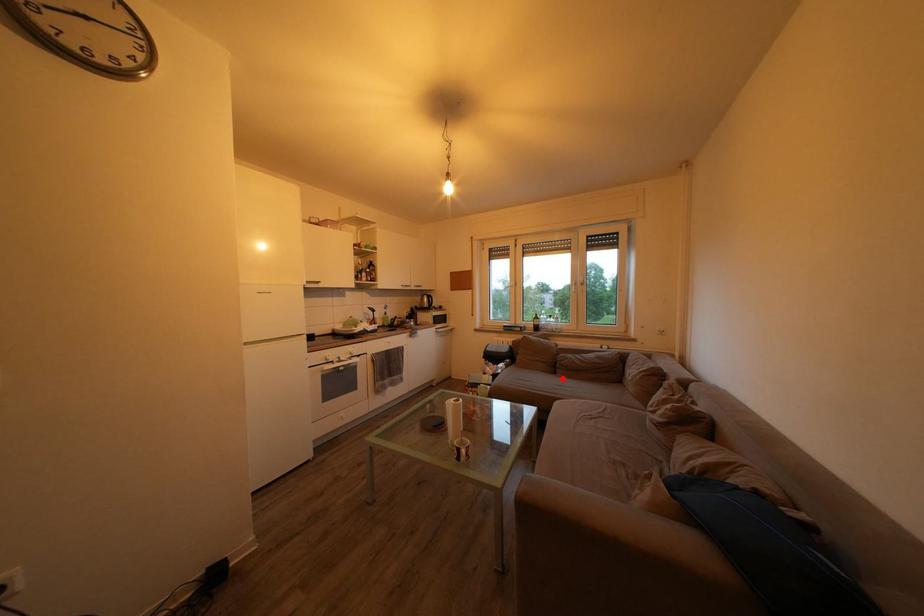
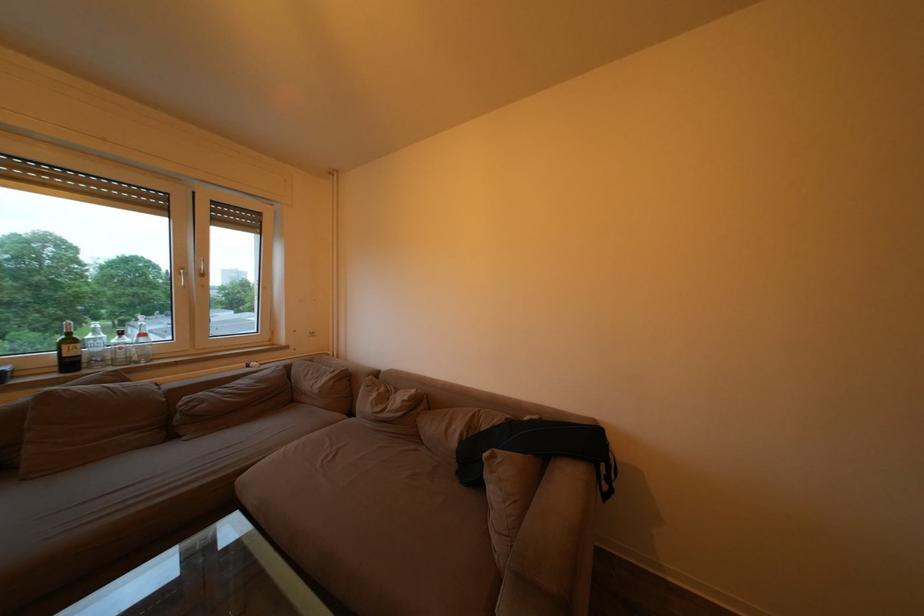
Locate, in the second image, the point that corresponds to the highlighted location in the first image.

(178, 443)